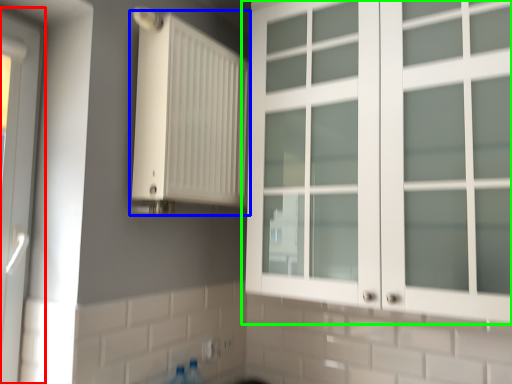
Question: Considering the real-world distances, which object is farthest from door (highlighted by a red box)? radiator (highlighted by a blue box) or cupboard (highlighted by a green box)?

Choices:
 (A) radiator
 (B) cupboard

Answer: (B)